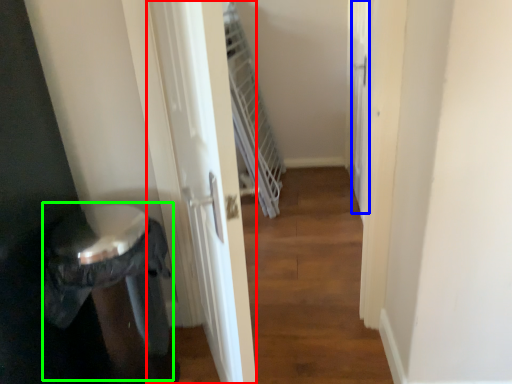
Question: Which object is positioned farthest from screen door (highlighted by a red box)? Select from screen door (highlighted by a blue box) and potty (highlighted by a green box).

Choices:
 (A) screen door
 (B) potty

Answer: (A)